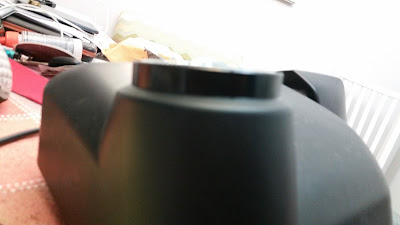
At what (x,y) coordinates should I click in order to perform the action: click on black wire. Please return your answer as a coordinate pair (x, y). Looking at the image, I should click on (26, 132).